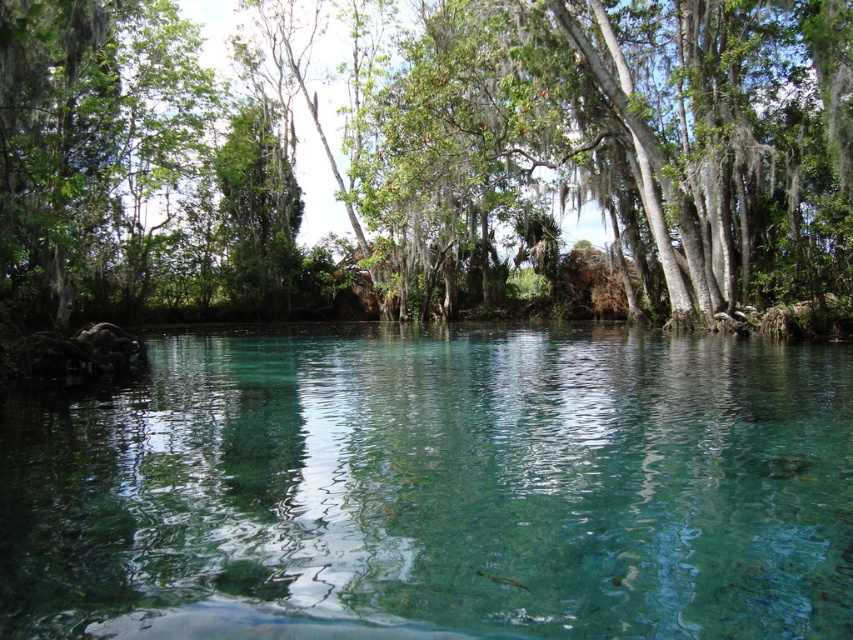
Question: Is clear glass river at center further to camera compared to green leafy tree at center?

Choices:
 (A) no
 (B) yes

Answer: (A)

Question: Which of the following is the farthest from the observer?

Choices:
 (A) clear glass river at center
 (B) green leafy tree at center

Answer: (B)

Question: Is clear glass river at center above green leafy tree at center?

Choices:
 (A) no
 (B) yes

Answer: (A)

Question: Is clear glass river at center in front of green leafy tree at center?

Choices:
 (A) no
 (B) yes

Answer: (B)

Question: Which point appears farthest from the camera in this image?

Choices:
 (A) (180, 372)
 (B) (625, 58)

Answer: (B)